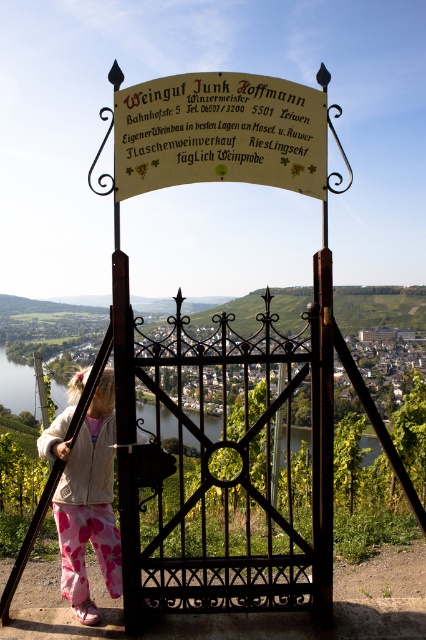
Can you confirm if black wrought iron gate at center is positioned to the left of fluffy pink pants at lower left?

In fact, black wrought iron gate at center is to the right of fluffy pink pants at lower left.

Can you confirm if black wrought iron gate at center is shorter than fluffy pink pants at lower left?

No, black wrought iron gate at center is not shorter than fluffy pink pants at lower left.

Who is more distant from viewer, (267,522) or (101,467)?

Point (101,467)

At what (x,y) coordinates should I click in order to perform the action: click on black wrought iron gate at center. Please return your answer as a coordinate pair (x, y). The height and width of the screenshot is (640, 426). Looking at the image, I should click on (224, 465).

Looking at this image, between wooden sign at center and fluffy pink pants at lower left, which one appears on the right side from the viewer's perspective?

wooden sign at center is more to the right.

Which is above, wooden sign at center or fluffy pink pants at lower left?

wooden sign at center

Is point (161, 152) closer to camera compared to point (78, 513)?

Yes, point (161, 152) is closer to viewer.

Image resolution: width=426 pixels, height=640 pixels. I want to click on wooden sign at center, so click(219, 132).

Which is in front, point (321, 340) or point (199, 132)?

Positioned in front is point (199, 132).

Between point (137, 531) and point (149, 184), which one is positioned behind?

Point (137, 531)

Find the location of a particular element. black wrought iron gate at center is located at coordinates (224, 465).